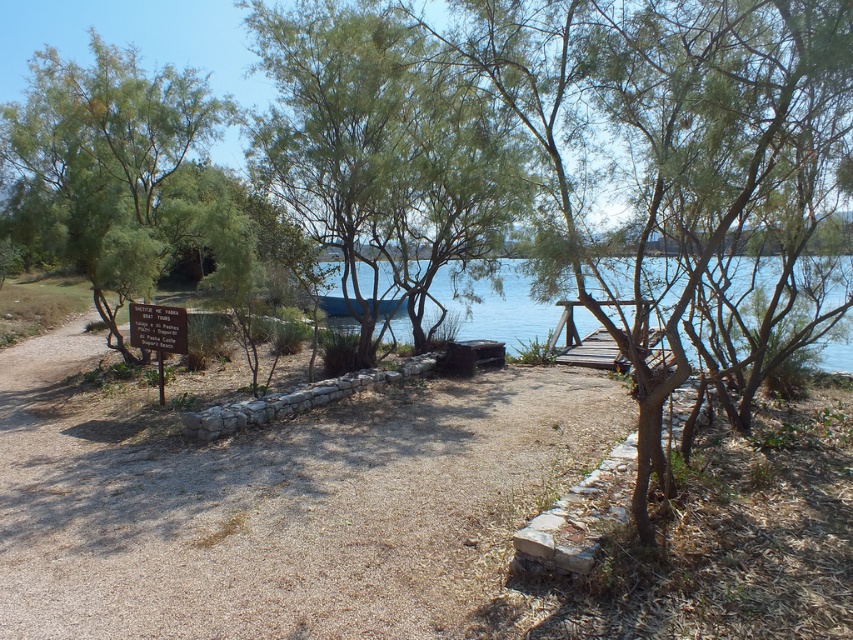
Question: In this image, where is brown gravel path at center located relative to white wooden sign at lower left?

Choices:
 (A) left
 (B) right

Answer: (B)

Question: Which object appears farthest from the camera in this image?

Choices:
 (A) green leafy tree at center
 (B) blue water at center

Answer: (A)

Question: Which point is closer to the camera?

Choices:
 (A) (312, 465)
 (B) (369, 273)
 (C) (486, 177)
 (D) (26, 186)

Answer: (C)

Question: Is green leafy tree at left above white wooden sign at lower left?

Choices:
 (A) yes
 (B) no

Answer: (A)

Question: Can you confirm if brown gravel path at center is positioned below green leafy tree at center?

Choices:
 (A) no
 (B) yes

Answer: (B)

Question: Among these objects, which one is farthest from the camera?

Choices:
 (A) green leafy tree at center
 (B) blue water at center
 (C) green leafy tree at left
 (D) brown gravel path at center

Answer: (C)